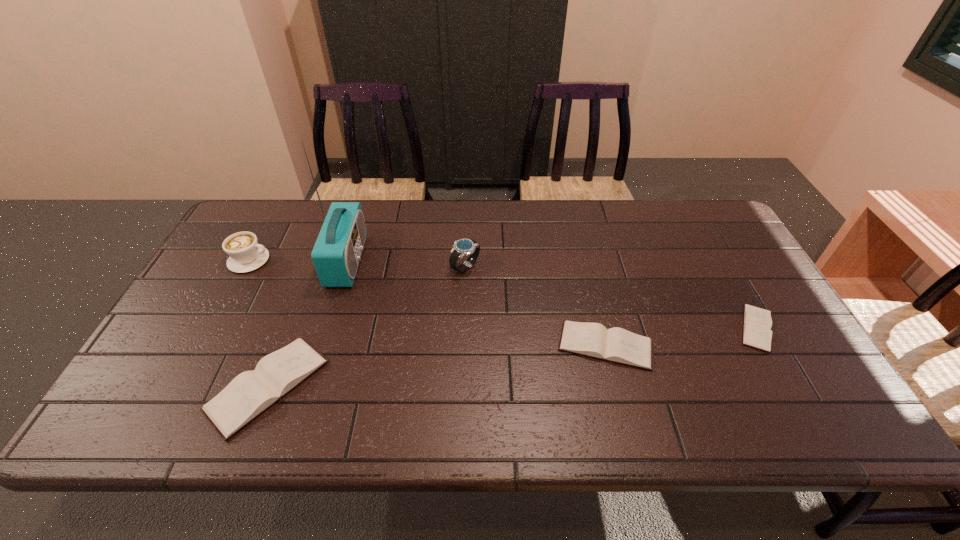
If equal spacing is desired by inserting an extra diary among them, please point out a free spot for this new diary. Please provide its 2D coordinates. Your answer should be formatted as a tuple, i.e. [(x, y)], where the tuple contains the x and y coordinates of a point satisfying the conditions above.

[(444, 365)]